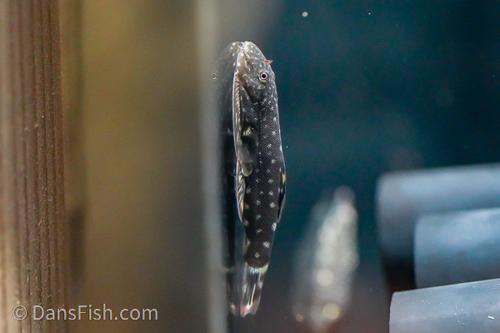
Find the location of a particular element. The height and width of the screenshot is (333, 500). wood piece is located at coordinates (36, 142).